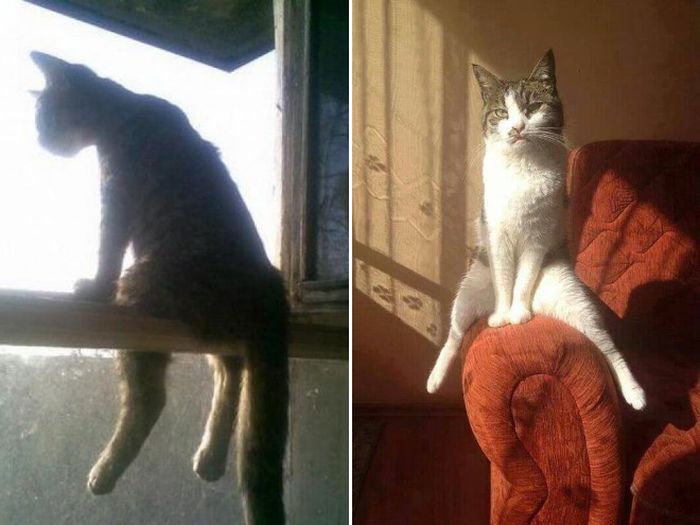
I want to click on window, so click(x=325, y=200), click(x=61, y=448), click(x=297, y=471).